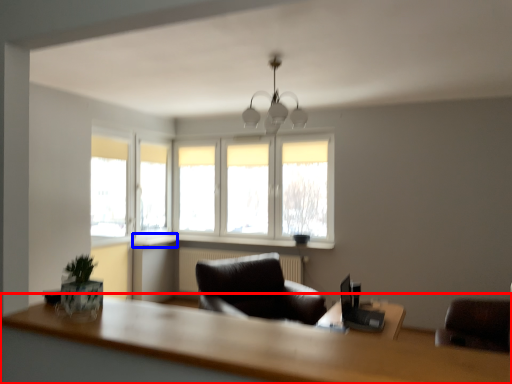
Question: Which object is further to the camera taking this photo, table (highlighted by a red box) or window sill (highlighted by a blue box)?

Choices:
 (A) table
 (B) window sill

Answer: (B)